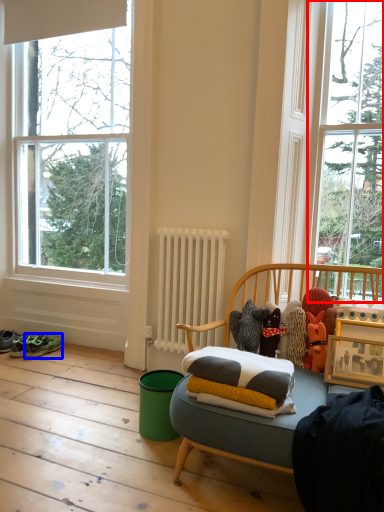
Question: Which object is further to the camera taking this photo, window (highlighted by a red box) or running shoe (highlighted by a blue box)?

Choices:
 (A) window
 (B) running shoe

Answer: (B)